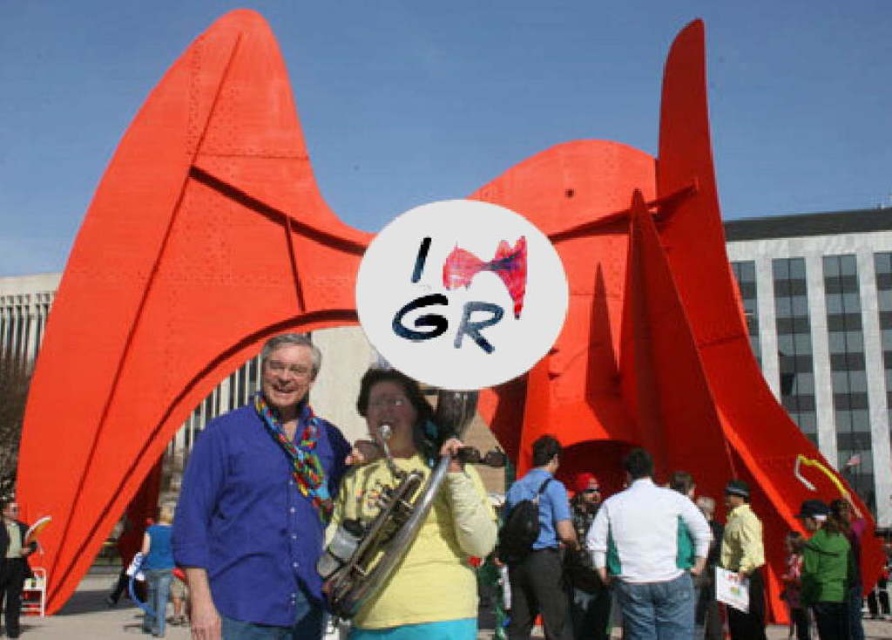
The image size is (892, 640). What do you see at coordinates (649, 552) in the screenshot?
I see `white/green fabric jacket at center` at bounding box center [649, 552].

Is point (610, 518) behind point (748, 493)?

No, (610, 518) is in front of (748, 493).

Identify the location of white/green fabric jacket at center. This screenshot has height=640, width=892. (649, 552).

Does white/green fabric jacket at center have a greater height compared to blue fabric backpack at center?

Incorrect, white/green fabric jacket at center's height is not larger of blue fabric backpack at center's.

Does point (625, 502) lie in front of point (539, 570)?

Yes.

The image size is (892, 640). In order to click on white/green fabric jacket at center in this screenshot , I will do `click(649, 552)`.

Between point (196, 492) and point (752, 538), which one is positioned behind?

Point (752, 538)

Is point (279, 586) in front of point (749, 576)?

Yes, point (279, 586) is in front of point (749, 576).

Consider the image. Who is more distant from viewer, (271, 493) or (754, 515)?

Positioned behind is point (754, 515).

Identify the location of blue cotton shirt at center. This screenshot has width=892, height=640. (260, 506).